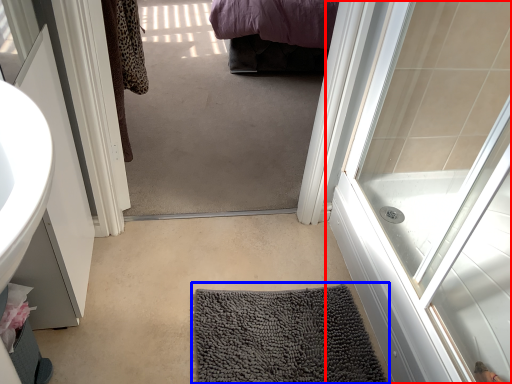
Question: Among these objects, which one is farthest to the camera, door (highlighted by a red box) or bath mat (highlighted by a blue box)?

Choices:
 (A) door
 (B) bath mat

Answer: (B)